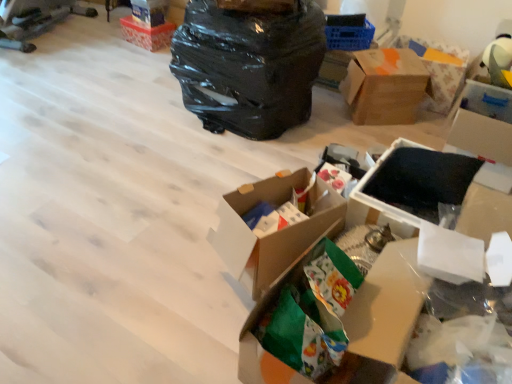
Question: In terms of height, does black plastic bag at upper center look taller or shorter compared to orange-patterned cardboard box at upper right?

Choices:
 (A) tall
 (B) short

Answer: (A)

Question: Considering the positions of black plastic bag at upper center and orange-patterned cardboard box at upper right in the image, is black plastic bag at upper center wider or thinner than orange-patterned cardboard box at upper right?

Choices:
 (A) wide
 (B) thin

Answer: (A)

Question: Which object is the farthest from the white cardboard box at upper right, the 3th box from the front?

Choices:
 (A) matte plastic storage box at upper center, marked as the 1th storage box in a left-to-right arrangement
 (B) cardboard box at center, the fourth box viewed from the top
 (C) white paper at lower right, which ranks as the fourth storage box in back-to-front order
 (D) green paper bag at center, the 1th box in the front-to-back sequence
 (E) black matte storage box at upper right, the 3th storage box in the front-to-back sequence

Answer: (A)

Question: Which of these objects is positioned closest to the brown cardboard box at upper right, positioned as the fourth box in front-to-back order?

Choices:
 (A) matte plastic storage box at upper center, arranged as the first storage box when viewed from the top
 (B) black foam at center, the 2th storage box viewed from the right
 (C) orange cardboard box at upper left, the first box in the back-to-front sequence
 (D) orange-patterned cardboard box at upper right
 (E) cardboard box at center, which appears as the 2th box when viewed from the left

Answer: (D)